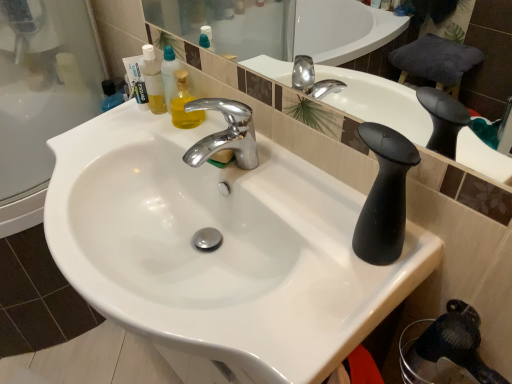
Locate an element on the screen. This screenshot has width=512, height=384. free space in front of translucent plastic mouthwash at upper left is located at coordinates (140, 138).